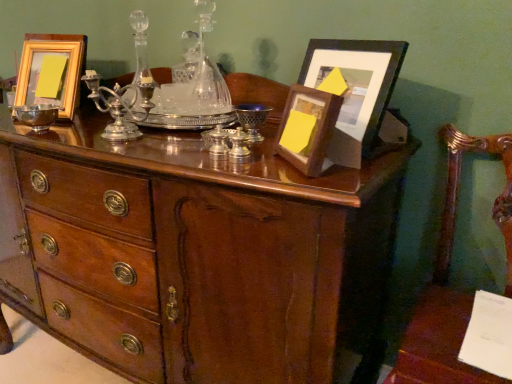
Identify the location of vacant space that's between silver metallic candle holder at center, the second candle holder positioned from the front, and wooden picture frame at upper right, which is the 2th picture frame from right to left. (264, 163).